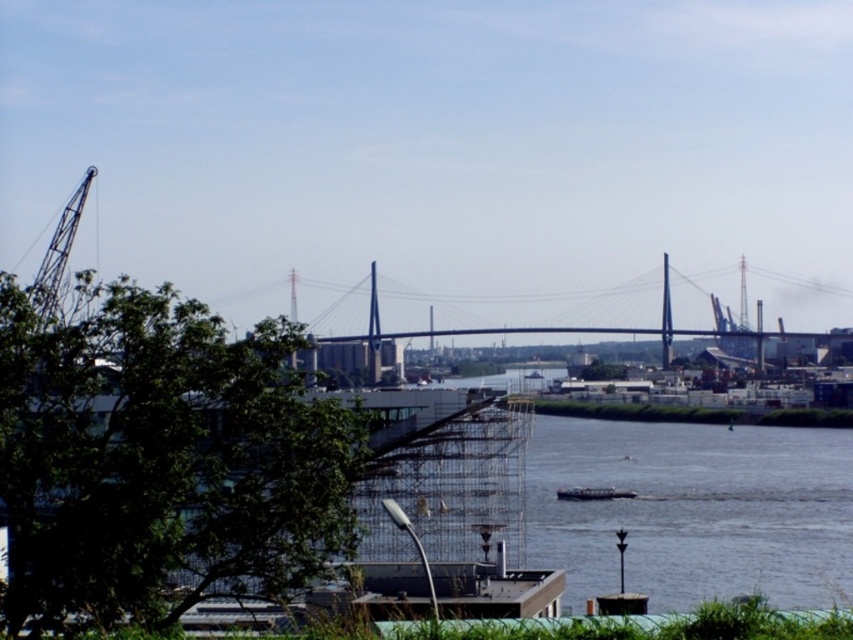
Does green leafy tree at center appear over metallic gray crane at left?

Actually, green leafy tree at center is below metallic gray crane at left.

Does green leafy tree at center lie behind metallic gray crane at left?

No, green leafy tree at center is closer to the viewer.

I want to click on green leafy tree at center, so click(161, 460).

Looking at this image, who is higher up, green leafy tree at center or white plastic boat at center?

green leafy tree at center is above.

Can you confirm if green leafy tree at center is shorter than white plastic boat at center?

In fact, green leafy tree at center may be taller than white plastic boat at center.

Is point (45, 547) positioned after point (566, 490)?

That is False.

You are a GUI agent. You are given a task and a screenshot of the screen. Output one action in this format:
    pyautogui.click(x=<x>, y=<y>)
    Task: Click on the green leafy tree at center
    This screenshot has height=640, width=853.
    Given the screenshot: What is the action you would take?
    pyautogui.click(x=161, y=460)

Is metallic gray crane at left bigger than white plastic boat at center?

Indeed, metallic gray crane at left has a larger size compared to white plastic boat at center.

Does metallic gray crane at left appear on the right side of white plastic boat at center?

In fact, metallic gray crane at left is to the left of white plastic boat at center.

Locate an element on the screen. metallic gray crane at left is located at coordinates (57, 253).